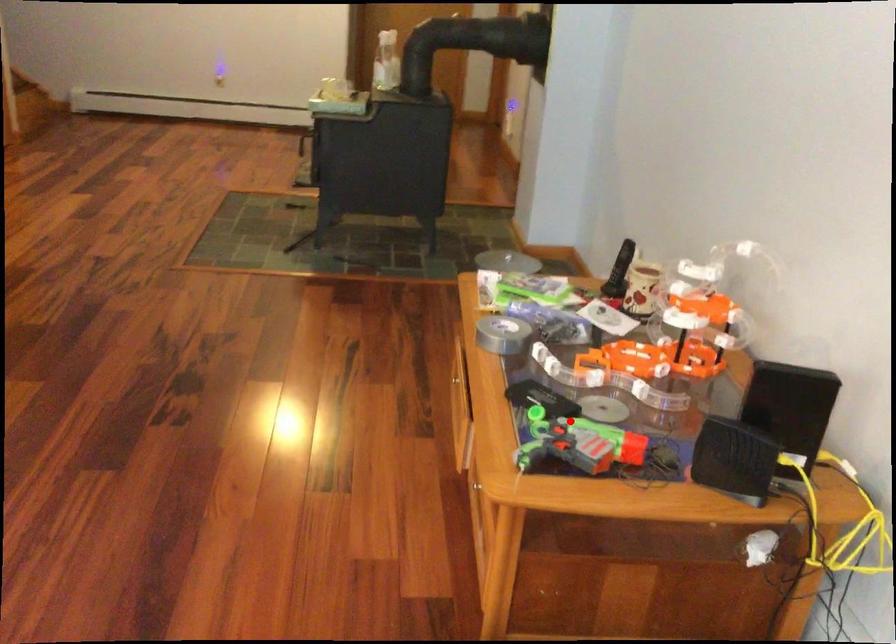
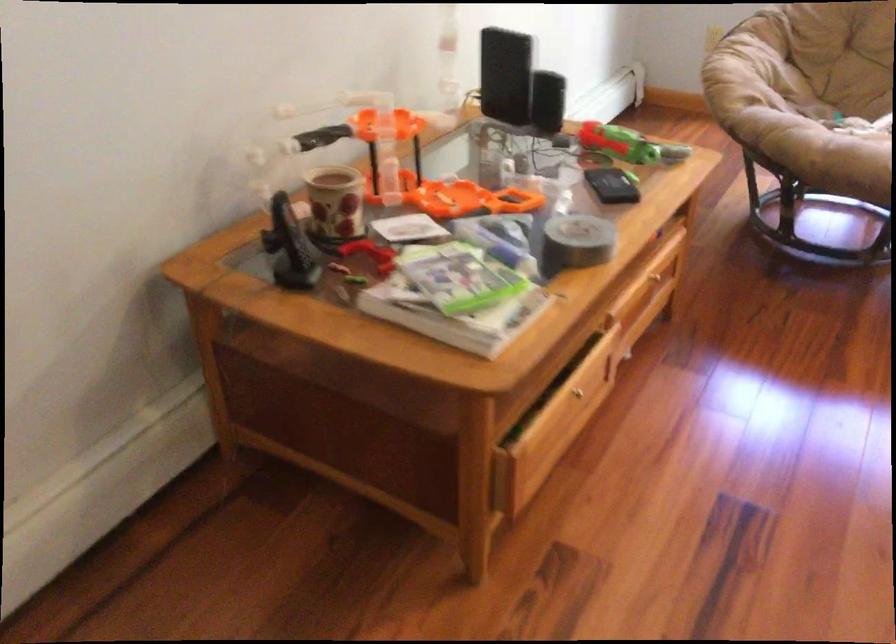
Question: I am providing you with two images of the same scene from different viewpoints. A red point is shown in image1. For the corresponding object point in image2, is it positioned nearer or farther from the camera?

Choices:
 (A) Nearer
 (B) Farther

Answer: (B)